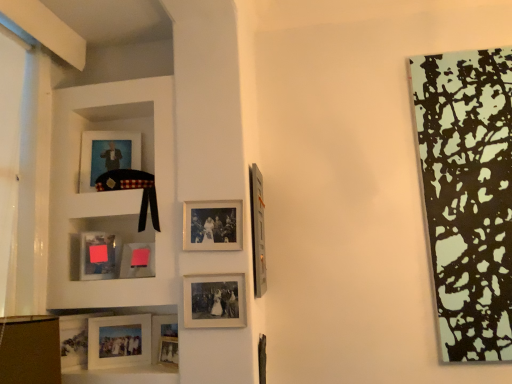
Image resolution: width=512 pixels, height=384 pixels. What do you see at coordinates (75, 340) in the screenshot? I see `matte silver picture frame at lower left, acting as the tenth picture frame starting from the right` at bounding box center [75, 340].

What is the approximate width of matte glass picture frame at lower left, which ranks as the 3th picture frame in left-to-right order?

It is 2.85 inches.

Image resolution: width=512 pixels, height=384 pixels. What do you see at coordinates (138, 260) in the screenshot? I see `pink matte picture frame at lower center, positioned as the sixth picture frame in right-to-left order` at bounding box center [138, 260].

Find the location of a particular element. The image size is (512, 384). matte silver photo frame at center, which ranks as the third picture frame in right-to-left order is located at coordinates (212, 225).

In order to face matte silver picture frame at center, the 2th picture frame in the right-to-left sequence, should I rotate leftwards or rightwards?

Turn left approximately 5.471 degrees to face it.

Describe the element at coordinates (30, 349) in the screenshot. The image size is (512, 384). I see `brown fabric at lower left, placed as the first shelf when sorted from front to back` at that location.

You are a GUI agent. You are given a task and a screenshot of the screen. Output one action in this format:
    pyautogui.click(x=<x>, y=<y>)
    Task: Click on the matte silver picture frame at lower left, acting as the tenth picture frame starting from the right
    The width and height of the screenshot is (512, 384).
    Given the screenshot: What is the action you would take?
    pyautogui.click(x=75, y=340)

Is matte silver picture frame at center, the 9th picture frame when ordered from left to right, facing towards matte silver picture frame at lower left, the first picture frame when ordered from left to right?

No, matte silver picture frame at center, the 9th picture frame when ordered from left to right, is not facing towards matte silver picture frame at lower left, the first picture frame when ordered from left to right.

Which of these two, matte silver picture frame at center, the 9th picture frame when ordered from left to right, or matte silver picture frame at lower left, acting as the tenth picture frame starting from the right, stands taller?

Standing taller between the two is matte silver picture frame at lower left, acting as the tenth picture frame starting from the right.

From a real-world perspective, is matte silver picture frame at center, the 2th picture frame in the right-to-left sequence, beneath matte silver picture frame at lower left, acting as the tenth picture frame starting from the right?

Incorrect, from a real-world perspective, matte silver picture frame at center, the 2th picture frame in the right-to-left sequence, is higher than matte silver picture frame at lower left, acting as the tenth picture frame starting from the right.

From the image's perspective, is matte silver picture frame at center, the 9th picture frame when ordered from left to right, located above matte silver picture frame at lower left, the first picture frame when ordered from left to right?

Yes, from the image's perspective, matte silver picture frame at center, the 9th picture frame when ordered from left to right, is over matte silver picture frame at lower left, the first picture frame when ordered from left to right.

Does matte silver picture frame at lower center, which is counted as the 7th picture frame, starting from the right, come in front of metallic silver picture frame at upper right, the tenth picture frame in the left-to-right sequence?

No, it is behind metallic silver picture frame at upper right, the tenth picture frame in the left-to-right sequence.

From the image's perspective, would you say matte silver picture frame at lower center, which is counted as the 7th picture frame, starting from the right, is positioned over metallic silver picture frame at upper right, the first picture frame from the right?

Incorrect, from the image's perspective, matte silver picture frame at lower center, which is counted as the 7th picture frame, starting from the right, is lower than metallic silver picture frame at upper right, the first picture frame from the right.

Which of these two, matte silver picture frame at lower center, placed as the 4th picture frame when sorted from left to right, or metallic silver picture frame at upper right, the first picture frame from the right, stands shorter?

Standing shorter between the two is matte silver picture frame at lower center, placed as the 4th picture frame when sorted from left to right.

From a real-world perspective, is matte silver picture frame at lower center, which is counted as the 7th picture frame, starting from the right, positioned under metallic silver picture frame at upper right, the first picture frame from the right, based on gravity?

Indeed, from a real-world perspective, matte silver picture frame at lower center, which is counted as the 7th picture frame, starting from the right, is positioned beneath metallic silver picture frame at upper right, the first picture frame from the right.

Find the location of `shelf that is the 2nd object located above the matte silver picture frame at lower center, arranged as the 7th picture frame when viewed from the left (from the image's perspective)`. shelf that is the 2nd object located above the matte silver picture frame at lower center, arranged as the 7th picture frame when viewed from the left (from the image's perspective) is located at coordinates (112, 192).

Is white matte shelf at upper left, the second shelf when ordered from bottom to top, positioned far away from matte silver picture frame at lower center, the fourth picture frame viewed from the right?

white matte shelf at upper left, the second shelf when ordered from bottom to top, is actually quite close to matte silver picture frame at lower center, the fourth picture frame viewed from the right.

Who is smaller, white matte shelf at upper left, which is counted as the 1th shelf, starting from the back, or matte silver picture frame at lower center, the fourth picture frame viewed from the right?

matte silver picture frame at lower center, the fourth picture frame viewed from the right.

Considering the sizes of objects white matte shelf at upper left, which is counted as the 1th shelf, starting from the back, and matte silver picture frame at lower center, arranged as the 7th picture frame when viewed from the left, in the image provided, who is thinner, white matte shelf at upper left, which is counted as the 1th shelf, starting from the back, or matte silver picture frame at lower center, arranged as the 7th picture frame when viewed from the left,?

matte silver picture frame at lower center, arranged as the 7th picture frame when viewed from the left.

Between matte silver picture frame at lower center, placed as the 4th picture frame when sorted from left to right, and matte silver picture frame at lower center, the fourth picture frame viewed from the right, which one appears on the right side from the viewer's perspective?

From the viewer's perspective, matte silver picture frame at lower center, the fourth picture frame viewed from the right, appears more on the right side.

You are a GUI agent. You are given a task and a screenshot of the screen. Output one action in this format:
    pyautogui.click(x=<x>, y=<y>)
    Task: Click on the 3rd picture frame to the left of the matte silver picture frame at lower center, arranged as the 7th picture frame when viewed from the left, counting from the anchor's position
    This screenshot has width=512, height=384.
    Given the screenshot: What is the action you would take?
    pyautogui.click(x=119, y=341)

From a real-world perspective, between matte silver picture frame at lower center, placed as the 4th picture frame when sorted from left to right, and matte silver picture frame at lower center, the fourth picture frame viewed from the right, who is vertically lower?

matte silver picture frame at lower center, the fourth picture frame viewed from the right.

Is matte silver picture frame at lower center, which is counted as the 7th picture frame, starting from the right, turned away from matte silver picture frame at lower center, arranged as the 7th picture frame when viewed from the left?

No, matte silver picture frame at lower center, which is counted as the 7th picture frame, starting from the right, is not facing the opposite direction of matte silver picture frame at lower center, arranged as the 7th picture frame when viewed from the left.

From a real-world perspective, relative to brown fabric at lower left, the 2th shelf viewed from the top, is pink matte picture frame at lower center, acting as the 5th picture frame starting from the left, vertically above or below?

In terms of real-world spatial position, pink matte picture frame at lower center, acting as the 5th picture frame starting from the left, is above brown fabric at lower left, the 2th shelf viewed from the top.

Does pink matte picture frame at lower center, acting as the 5th picture frame starting from the left, have a larger size compared to brown fabric at lower left, the 2th shelf viewed from the top?

No.

From the image's perspective, does pink matte picture frame at lower center, positioned as the sixth picture frame in right-to-left order, appear higher than brown fabric at lower left, the first shelf positioned from the bottom?

Yes.

Is white matte shelf at upper left, which is counted as the 1th shelf, starting from the back, not close to metallic silver picture frame at upper right, the first picture frame from the right?

No, white matte shelf at upper left, which is counted as the 1th shelf, starting from the back, is not far from metallic silver picture frame at upper right, the first picture frame from the right.

From a real-world perspective, is white matte shelf at upper left, the second shelf when ordered from bottom to top, physically located above or below metallic silver picture frame at upper right, the tenth picture frame in the left-to-right sequence?

white matte shelf at upper left, the second shelf when ordered from bottom to top, is situated higher than metallic silver picture frame at upper right, the tenth picture frame in the left-to-right sequence, in the real world.

Which of these two, white matte shelf at upper left, the second shelf when ordered from bottom to top, or metallic silver picture frame at upper right, the tenth picture frame in the left-to-right sequence, is wider?

white matte shelf at upper left, the second shelf when ordered from bottom to top.

Between white matte shelf at upper left, which is counted as the 1th shelf, starting from the back, and metallic silver picture frame at upper right, the tenth picture frame in the left-to-right sequence, which one has smaller size?

With smaller size is metallic silver picture frame at upper right, the tenth picture frame in the left-to-right sequence.

Is point (26, 356) closer to viewer compared to point (69, 335)?

Yes, it is.

From the picture: Does brown fabric at lower left, placed as the first shelf when sorted from front to back, have a larger size compared to matte silver picture frame at lower left, the first picture frame when ordered from left to right?

Yes, brown fabric at lower left, placed as the first shelf when sorted from front to back, is bigger than matte silver picture frame at lower left, the first picture frame when ordered from left to right.

Would you consider brown fabric at lower left, which appears as the second shelf when viewed from the back, to be distant from matte silver picture frame at lower left, acting as the tenth picture frame starting from the right?

No, brown fabric at lower left, which appears as the second shelf when viewed from the back, is not far away from matte silver picture frame at lower left, acting as the tenth picture frame starting from the right.

Is matte silver picture frame at lower left, the first picture frame when ordered from left to right, at the back of brown fabric at lower left, which appears as the second shelf when viewed from the back?

No, brown fabric at lower left, which appears as the second shelf when viewed from the back, is not facing away from matte silver picture frame at lower left, the first picture frame when ordered from left to right.

This screenshot has width=512, height=384. Identify the location of the 4th picture frame in front of the matte silver picture frame at lower left, acting as the tenth picture frame starting from the right, starting your count from the anchor. (214, 300).

The width and height of the screenshot is (512, 384). There is a matte silver picture frame at lower center, placed as the 4th picture frame when sorted from left to right. Identify the location of the 6th picture frame above it (from the image's perspective). (258, 230).

Which object lies further to the anchor point matte silver picture frame at lower center, which ranks as the 6th picture frame in left-to-right order, metallic silver picture frame at upper right, the tenth picture frame in the left-to-right sequence, or white matte shelf at upper left, which is counted as the 1th shelf, starting from the back?

white matte shelf at upper left, which is counted as the 1th shelf, starting from the back, is further to matte silver picture frame at lower center, which ranks as the 6th picture frame in left-to-right order.

Based on their spatial positions, is matte silver picture frame at lower center, the fourth picture frame viewed from the right, or metallic silver picture frame at upper right, the tenth picture frame in the left-to-right sequence, further from pink matte picture frame at lower center, acting as the 5th picture frame starting from the left?

metallic silver picture frame at upper right, the tenth picture frame in the left-to-right sequence.

Considering their positions, is matte silver picture frame at lower center, placed as the 4th picture frame when sorted from left to right, positioned further to matte glass picture frame at lower left, the 8th picture frame in the right-to-left sequence, than matte silver picture frame at lower center, the fourth picture frame viewed from the right?

matte silver picture frame at lower center, the fourth picture frame viewed from the right.

Estimate the real-world distances between objects in this image. Which object is further from pink matte picture frame at lower center, positioned as the sixth picture frame in right-to-left order, matte silver picture frame at center, the 9th picture frame when ordered from left to right, or brown fabric at lower left, the 2th shelf viewed from the top?

Among the two, brown fabric at lower left, the 2th shelf viewed from the top, is located further to pink matte picture frame at lower center, positioned as the sixth picture frame in right-to-left order.

Estimate the real-world distances between objects in this image. Which object is further from matte silver picture frame at lower center, which is counted as the 7th picture frame, starting from the right, matte silver photo frame at center, which ranks as the third picture frame in right-to-left order, or white matte shelf at upper left, the second shelf when ordered from bottom to top?

Based on the image, matte silver photo frame at center, which ranks as the third picture frame in right-to-left order, appears to be further to matte silver picture frame at lower center, which is counted as the 7th picture frame, starting from the right.

Estimate the real-world distances between objects in this image. Which object is further from matte silver photo frame at center, positioned as the eighth picture frame in left-to-right order, matte silver picture frame at center, the 9th picture frame when ordered from left to right, or matte black picture frame at upper left, acting as the ninth picture frame starting from the right?

The object further to matte silver photo frame at center, positioned as the eighth picture frame in left-to-right order, is matte black picture frame at upper left, acting as the ninth picture frame starting from the right.

Looking at this image, based on their spatial positions, is brown fabric at lower left, the first shelf positioned from the bottom, or matte silver photo frame at center, positioned as the eighth picture frame in left-to-right order, closer to matte glass picture frame at lower left, which ranks as the 3th picture frame in left-to-right order?

brown fabric at lower left, the first shelf positioned from the bottom, is positioned closer to the anchor matte glass picture frame at lower left, which ranks as the 3th picture frame in left-to-right order.

Which object lies nearer to the anchor point matte silver picture frame at lower center, placed as the 4th picture frame when sorted from left to right, matte silver picture frame at lower center, which appears as the fifth picture frame when viewed from the right, or matte black picture frame at upper left, arranged as the second picture frame when viewed from the left?

matte silver picture frame at lower center, which appears as the fifth picture frame when viewed from the right, is closer to matte silver picture frame at lower center, placed as the 4th picture frame when sorted from left to right.

The width and height of the screenshot is (512, 384). I want to click on shelf situated between brown fabric at lower left, the first shelf positioned from the bottom, and matte silver photo frame at center, which ranks as the third picture frame in right-to-left order, from left to right, so click(x=112, y=192).

Find the location of a particular element. The image size is (512, 384). shelf that lies between matte black picture frame at upper left, acting as the ninth picture frame starting from the right, and pink matte picture frame at lower center, acting as the 5th picture frame starting from the left, from top to bottom is located at coordinates (112, 192).

The image size is (512, 384). In order to click on shelf between brown fabric at lower left, placed as the first shelf when sorted from front to back, and metallic silver picture frame at upper right, the first picture frame from the right, in the horizontal direction in this screenshot , I will do `click(112, 192)`.

The width and height of the screenshot is (512, 384). In order to click on shelf located between matte glass picture frame at lower left, which ranks as the 3th picture frame in left-to-right order, and matte silver photo frame at center, positioned as the eighth picture frame in left-to-right order, in the left-right direction in this screenshot , I will do `click(112, 192)`.